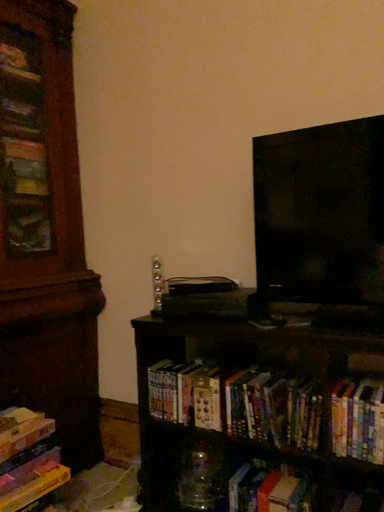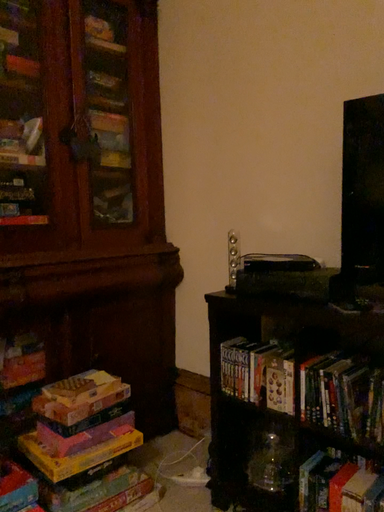
Question: Which way did the camera rotate in the video?

Choices:
 (A) rotated right
 (B) rotated left

Answer: (B)